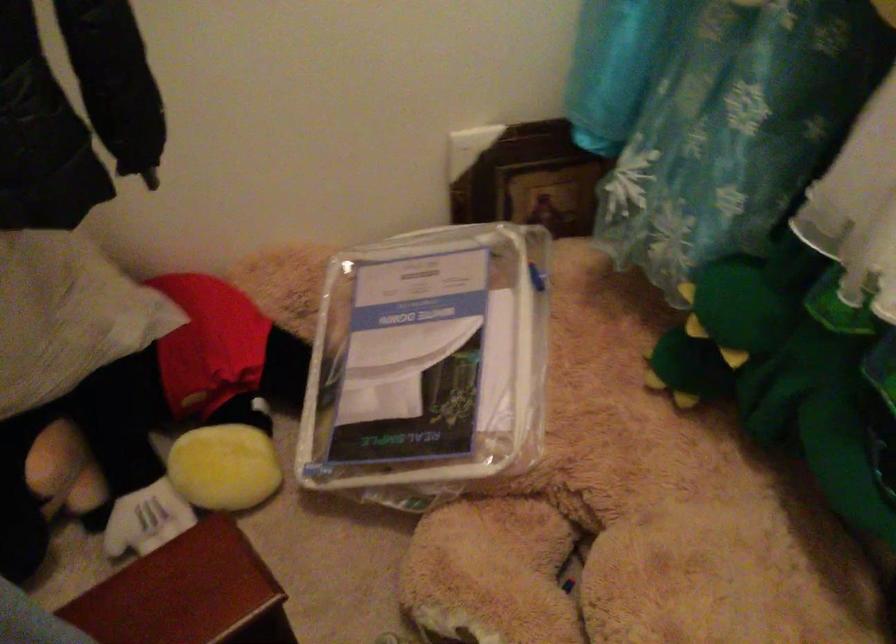
Where would you lift the Mickey Mouse toy? Please return your answer as a coordinate pair (x, y).

(188, 415)